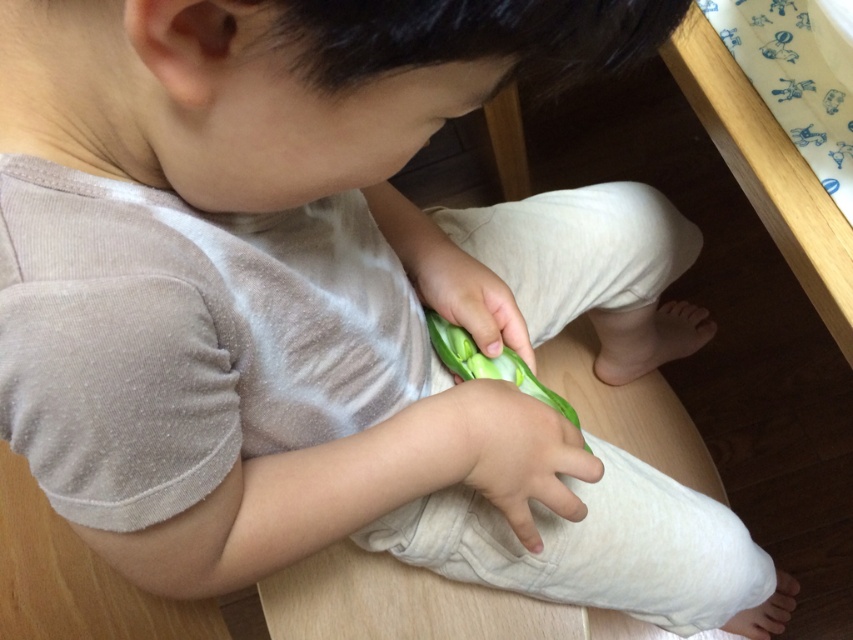
Question: Which object is farther from the camera taking this photo?

Choices:
 (A) green rubber toy at center
 (B) green matte flower at center

Answer: (B)

Question: Which of the following is the farthest from the observer?

Choices:
 (A) (790, 577)
 (B) (508, 330)

Answer: (A)

Question: Considering the relative positions of green rubber toy at center and green matte flower at center in the image provided, where is green rubber toy at center located with respect to green matte flower at center?

Choices:
 (A) below
 (B) above

Answer: (A)

Question: Can you confirm if green matte flower at center is positioned to the left of white soft hand at lower right?

Choices:
 (A) yes
 (B) no

Answer: (A)

Question: Among these points, which one is farthest from the camera?

Choices:
 (A) (793, 604)
 (B) (529, 428)
 (C) (508, 323)

Answer: (A)

Question: Does green rubber toy at center have a larger size compared to white soft hand at lower right?

Choices:
 (A) no
 (B) yes

Answer: (B)